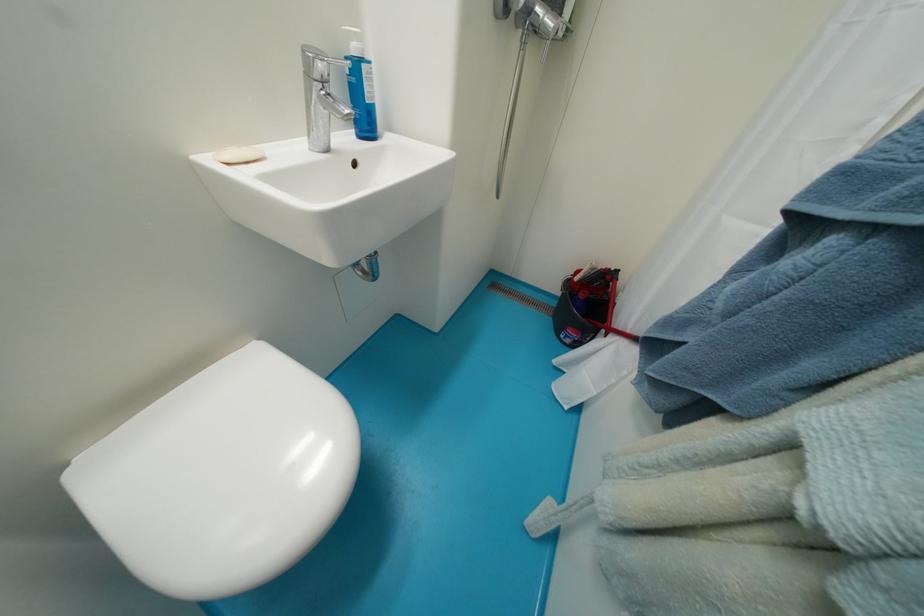
What do you see at coordinates (238, 155) in the screenshot? I see `a bar of soap` at bounding box center [238, 155].